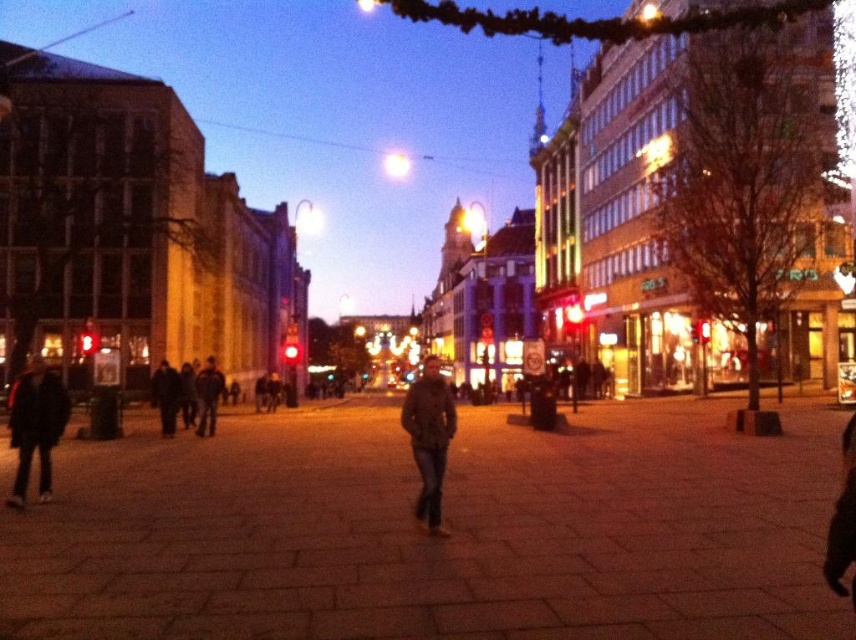
Question: Can you confirm if brown leather jacket at center is bigger than dark brown leather jacket at lower left?

Choices:
 (A) yes
 (B) no

Answer: (B)

Question: Is the position of brown leather jacket at center less distant than that of dark brown leather jacket at lower left?

Choices:
 (A) yes
 (B) no

Answer: (A)

Question: Which is nearer to the dark gray jacket at left?

Choices:
 (A) dark brown leather jacket at lower left
 (B) brown leather jacket at center
 (C) dark blue jeans at center

Answer: (C)

Question: From the image, what is the correct spatial relationship of dark brown leather jacket at lower left in relation to dark gray jacket at left?

Choices:
 (A) left
 (B) right

Answer: (A)

Question: Considering the real-world distances, which object is farthest from the brown leather jacket at center?

Choices:
 (A) dark gray jacket at left
 (B) dark brown leather jacket at lower left
 (C) dark blue jeans at center

Answer: (A)

Question: Among these points, which one is farthest from the camera?

Choices:
 (A) (170, 371)
 (B) (415, 440)
 (C) (197, 426)

Answer: (C)